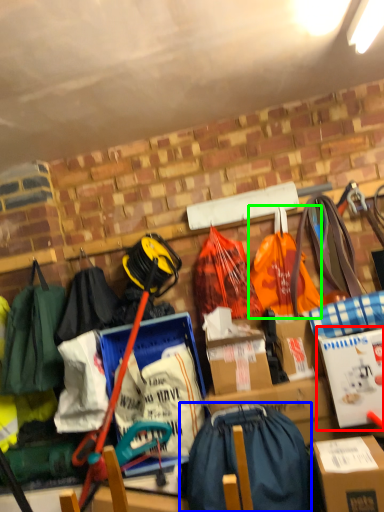
Question: Based on their relative distances, which object is farther from cardboard box (highlighted by a red box)? Choose from shoulder bag (highlighted by a blue box) and grocery bag (highlighted by a green box).

Choices:
 (A) shoulder bag
 (B) grocery bag

Answer: (B)